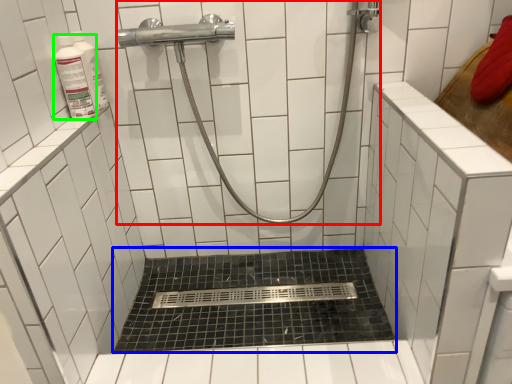
Question: Which object is the farthest from shower (highlighted by a red box)? Choose among these: bath (highlighted by a blue box) or toiletry (highlighted by a green box).

Choices:
 (A) bath
 (B) toiletry

Answer: (A)